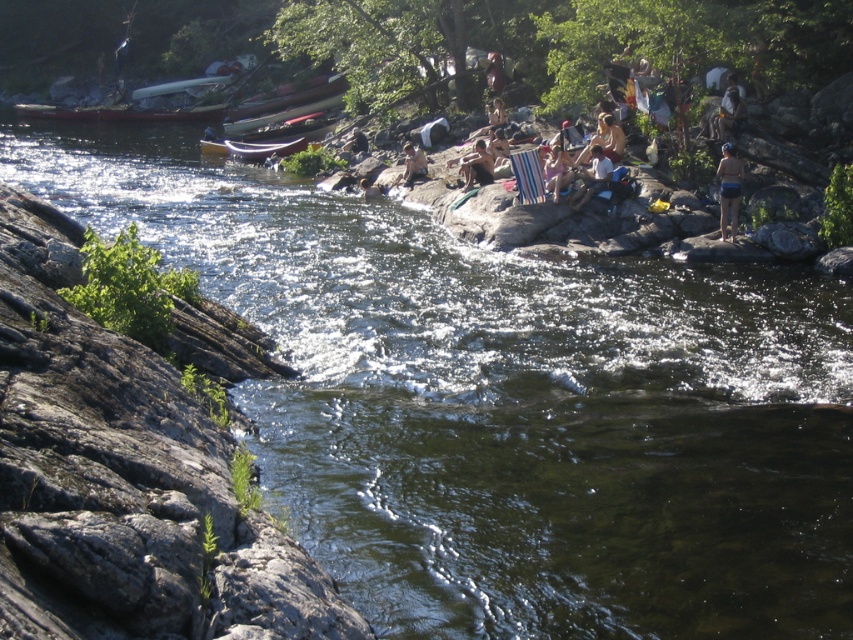
Question: Which object appears farthest from the camera in this image?

Choices:
 (A) striped fabric bag at center
 (B) matte white canoe at center

Answer: (B)

Question: Can you confirm if gray rock at lower left is smaller than matte brown canoe at upper left?

Choices:
 (A) yes
 (B) no

Answer: (B)

Question: Which point is closer to the camera?

Choices:
 (A) (473, 164)
 (B) (107, 627)

Answer: (B)

Question: Does white cotton shirt at center have a larger size compared to striped fabric bag at center?

Choices:
 (A) no
 (B) yes

Answer: (B)

Question: Which object is positioned closest to the gray rock at lower left?

Choices:
 (A) matte white canoe at center
 (B) blue fabric swimsuit at center
 (C) white cotton shirt at center
 (D) striped fabric bag at center

Answer: (B)

Question: Is blue fabric swimsuit at center thinner than brown leather backpack at center?

Choices:
 (A) no
 (B) yes

Answer: (B)